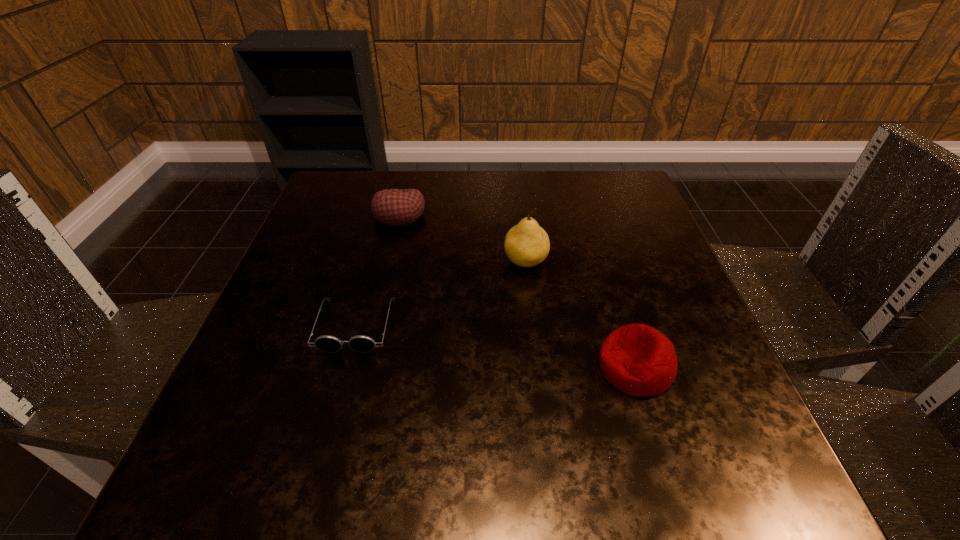
Identify the location of free spot at the left edge of the desktop. This screenshot has width=960, height=540. (301, 238).

The width and height of the screenshot is (960, 540). In the image, there is a desktop. What are the coordinates of `vacant space at the right edge` in the screenshot? It's located at (737, 427).

Identify the location of free space at the far left corner of the desktop. (367, 200).

You are a GUI agent. You are given a task and a screenshot of the screen. Output one action in this format:
    pyautogui.click(x=<x>, y=<y>)
    Task: Click on the vacant area at the far right corner of the desktop
    
    Given the screenshot: What is the action you would take?
    pyautogui.click(x=607, y=199)

This screenshot has width=960, height=540. Find the location of `free space between the farther beanbag and the third object from left to right`. free space between the farther beanbag and the third object from left to right is located at coordinates (463, 238).

Where is `empty location between the farthest object and the rightmost object`? This screenshot has width=960, height=540. empty location between the farthest object and the rightmost object is located at coordinates (517, 291).

Locate an element on the screen. The image size is (960, 540). empty location between the farther beanbag and the third object from left to right is located at coordinates (463, 238).

I want to click on vacant region between the farther beanbag and the sunglasses, so click(x=377, y=270).

Find the location of `unoccupied area between the farthest object and the rightmost object`. unoccupied area between the farthest object and the rightmost object is located at coordinates (517, 291).

The height and width of the screenshot is (540, 960). I want to click on unoccupied area between the farthest object and the nearer beanbag, so click(x=517, y=291).